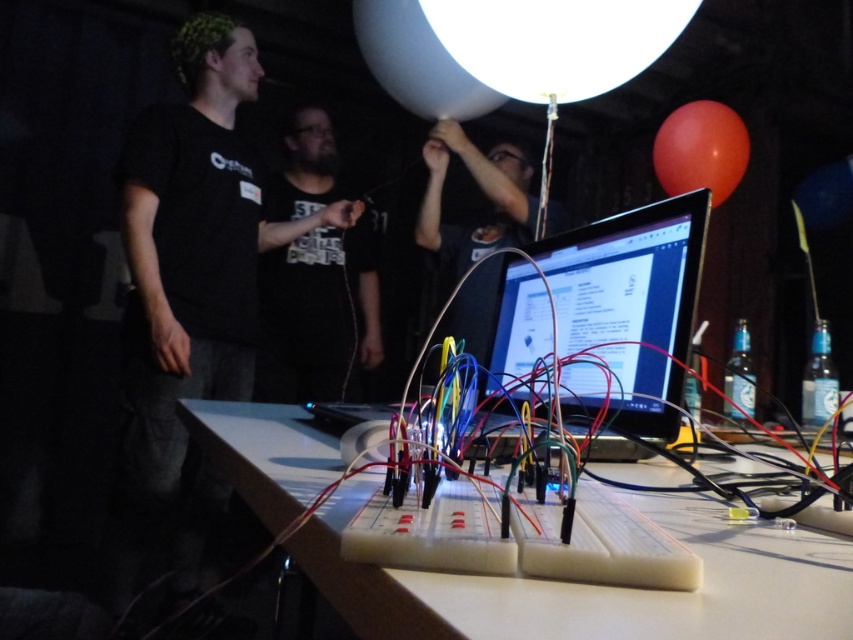
Question: Can you confirm if black matte t-shirt at center is bigger than rubber balloon at upper right?

Choices:
 (A) yes
 (B) no

Answer: (A)

Question: Which object is the closest to the translucent white balloon at upper center?

Choices:
 (A) black matte t-shirt at center
 (B) black glossy monitor at center
 (C) white plastic breadboard at center

Answer: (A)

Question: Can you confirm if black glossy monitor at center is wider than rubber balloon at upper right?

Choices:
 (A) yes
 (B) no

Answer: (B)

Question: Which point is farther to the camera?

Choices:
 (A) translucent white balloon at upper center
 (B) rubber balloon at upper right
 (C) white plastic breadboard at center
 (D) white glossy balloon at upper center

Answer: (B)

Question: Observing the image, what is the correct spatial positioning of white plastic breadboard at center in reference to rubber balloon at upper right?

Choices:
 (A) below
 (B) above

Answer: (A)

Question: Among these objects, which one is nearest to the camera?

Choices:
 (A) black glossy monitor at center
 (B) rubber balloon at upper right
 (C) white plastic breadboard at center
 (D) white glossy balloon at upper center

Answer: (C)